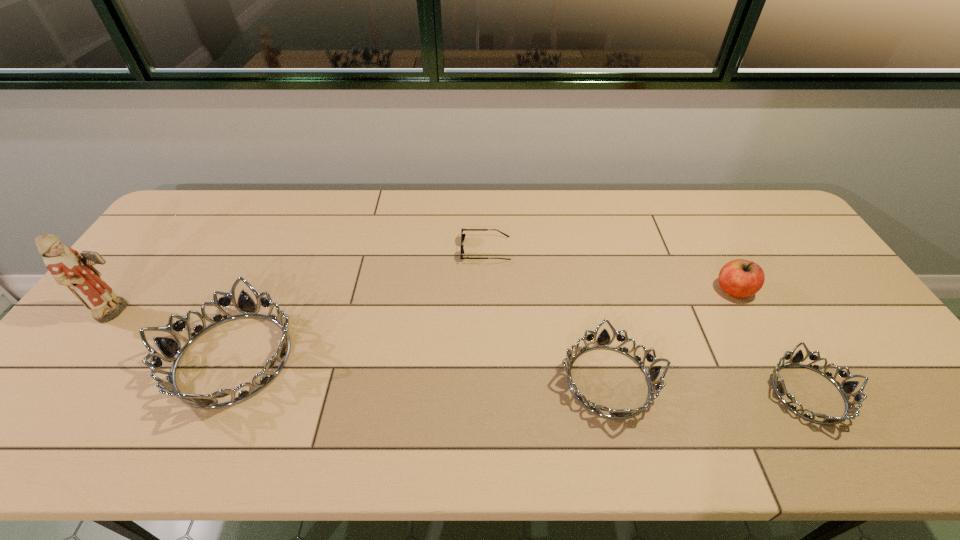
Please determine a free point for an extra tiara to ensure balance. Please provide its 2D coordinates. Your answer should be formatted as a tuple, i.e. [(x, y)], where the tuple contains the x and y coordinates of a point satisfying the conditions above.

[(418, 369)]